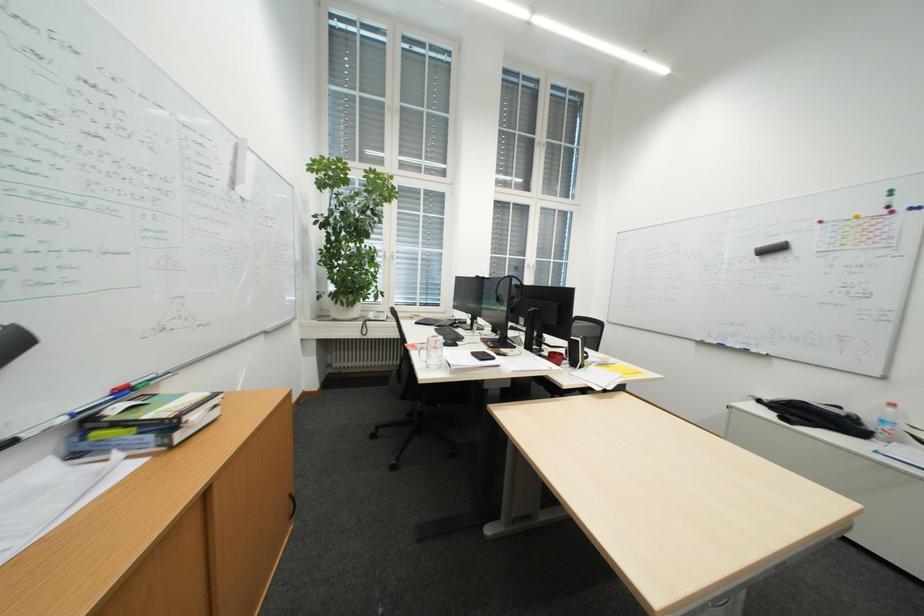
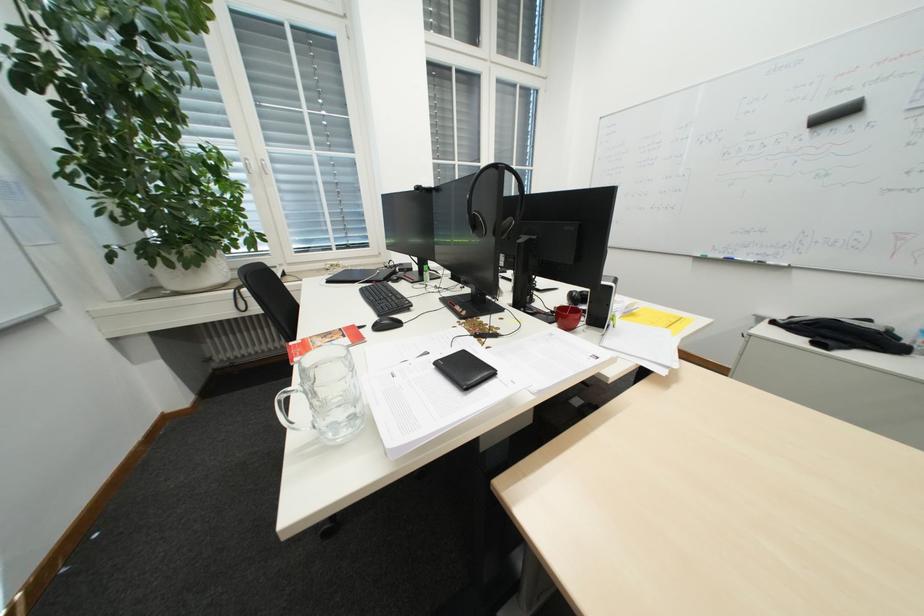
Question: The first image is from the beginning of the video and the second image is from the end. How did the camera likely rotate when shooting the video?

Choices:
 (A) Left
 (B) Right
 (C) Up
 (D) Down

Answer: (D)